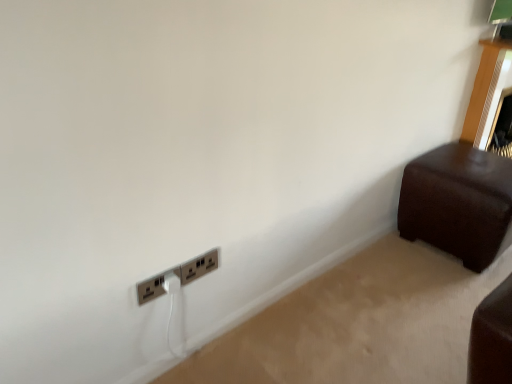
Question: Does brown leather ottoman at right appear on the left side of satin silver power plugs and sockets at lower left, which is the 1th power plugs and sockets from right to left?

Choices:
 (A) no
 (B) yes

Answer: (A)

Question: Considering the relative sizes of brown leather ottoman at right and satin silver power plugs and sockets at lower left, which is the 1th power plugs and sockets from right to left, in the image provided, is brown leather ottoman at right wider than satin silver power plugs and sockets at lower left, which is the 1th power plugs and sockets from right to left,?

Choices:
 (A) no
 (B) yes

Answer: (B)

Question: Is satin silver power plugs and sockets at lower left, which is the 1th power plugs and sockets from right to left, located within brown leather ottoman at right?

Choices:
 (A) no
 (B) yes

Answer: (A)

Question: Are brown leather ottoman at right and satin silver power plugs and sockets at lower left, placed as the 2th power plugs and sockets when sorted from left to right, beside each other?

Choices:
 (A) yes
 (B) no

Answer: (B)

Question: Does brown leather ottoman at right appear on the right side of satin silver power plugs and sockets at lower left, placed as the 2th power plugs and sockets when sorted from left to right?

Choices:
 (A) no
 (B) yes

Answer: (B)

Question: In terms of width, does metallic silver power plugs and sockets at lower left, the 1th power plugs and sockets in the left-to-right sequence, look wider or thinner when compared to brown leather ottoman at right?

Choices:
 (A) wide
 (B) thin

Answer: (B)

Question: Considering the relative positions of metallic silver power plugs and sockets at lower left, which ranks as the 2th power plugs and sockets in right-to-left order, and brown leather ottoman at right in the image provided, is metallic silver power plugs and sockets at lower left, which ranks as the 2th power plugs and sockets in right-to-left order, to the left or to the right of brown leather ottoman at right?

Choices:
 (A) right
 (B) left

Answer: (B)

Question: Which is correct: metallic silver power plugs and sockets at lower left, the 1th power plugs and sockets in the left-to-right sequence, is inside brown leather ottoman at right, or outside of it?

Choices:
 (A) outside
 (B) inside

Answer: (A)

Question: In terms of size, does metallic silver power plugs and sockets at lower left, which ranks as the 2th power plugs and sockets in right-to-left order, appear bigger or smaller than brown leather ottoman at right?

Choices:
 (A) small
 (B) big

Answer: (A)

Question: From the image's perspective, is metallic silver power plugs and sockets at lower left, the 1th power plugs and sockets in the left-to-right sequence, located above or below satin silver power plugs and sockets at lower left, which is the 1th power plugs and sockets from right to left?

Choices:
 (A) above
 (B) below

Answer: (B)

Question: Would you say metallic silver power plugs and sockets at lower left, the 1th power plugs and sockets in the left-to-right sequence, is to the left or to the right of satin silver power plugs and sockets at lower left, which is the 1th power plugs and sockets from right to left, in the picture?

Choices:
 (A) left
 (B) right

Answer: (A)

Question: From a real-world perspective, is metallic silver power plugs and sockets at lower left, the 1th power plugs and sockets in the left-to-right sequence, physically located above or below satin silver power plugs and sockets at lower left, which is the 1th power plugs and sockets from right to left?

Choices:
 (A) below
 (B) above

Answer: (A)

Question: Relative to satin silver power plugs and sockets at lower left, which is the 1th power plugs and sockets from right to left, is metallic silver power plugs and sockets at lower left, the 1th power plugs and sockets in the left-to-right sequence, in front or behind?

Choices:
 (A) behind
 (B) front

Answer: (B)

Question: Is brown leather ottoman at right inside the boundaries of satin silver power plugs and sockets at lower left, which is the 1th power plugs and sockets from right to left, or outside?

Choices:
 (A) outside
 (B) inside

Answer: (A)

Question: From a real-world perspective, is brown leather ottoman at right positioned above or below satin silver power plugs and sockets at lower left, which is the 1th power plugs and sockets from right to left?

Choices:
 (A) above
 (B) below

Answer: (B)